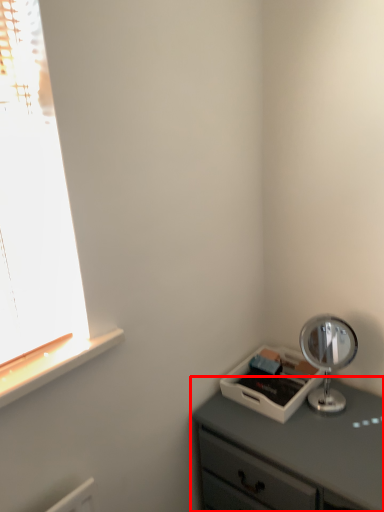
Question: From the image's perspective, considering the relative positions of chest of drawers (annotated by the red box) and table lamp in the image provided, where is chest of drawers (annotated by the red box) located with respect to the staircase?

Choices:
 (A) below
 (B) above

Answer: (A)